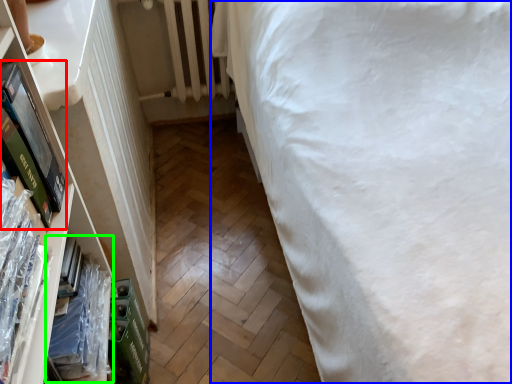
Question: Which object is positioned farthest from paperback book (highlighted by a red box)? Select from bed (highlighted by a blue box) and book (highlighted by a green box).

Choices:
 (A) bed
 (B) book

Answer: (A)